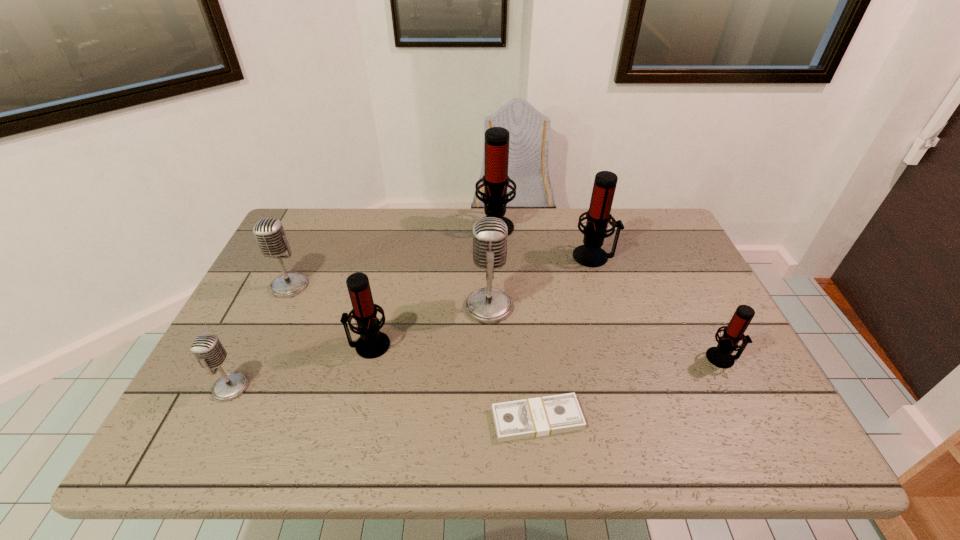
Identify the location of blank space that satisfies the following two spatial constraints: 1. on the back side of the nearest gray microphone; 2. on the left side of the leftmost red microphone. This screenshot has height=540, width=960. (252, 345).